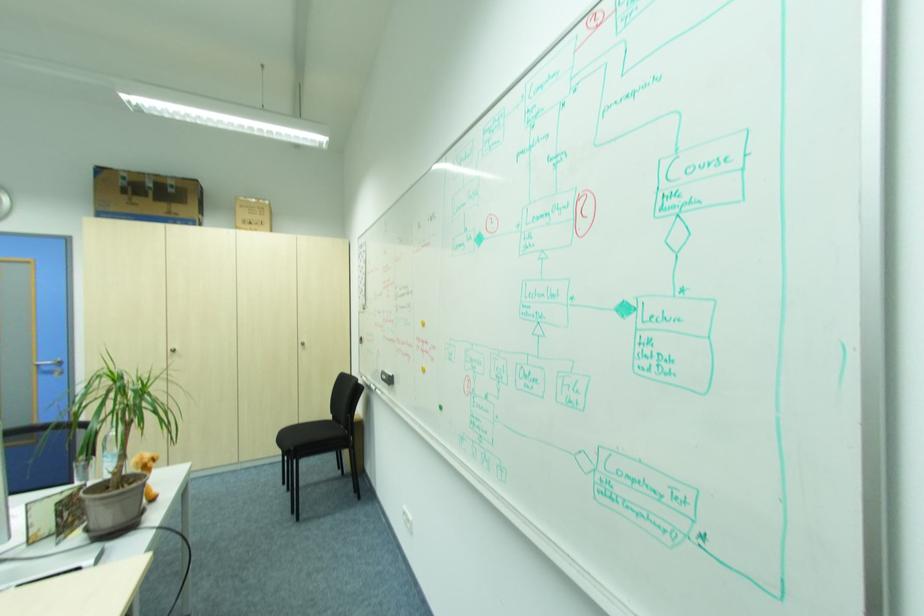
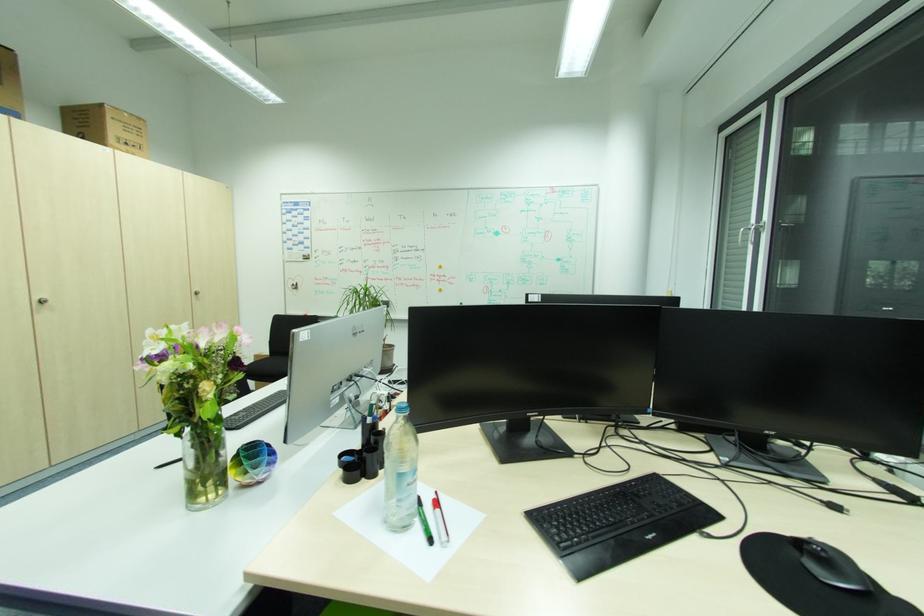
Locate, in the second image, the point that corresponds to the point at 179,351 in the first image.

(47, 302)